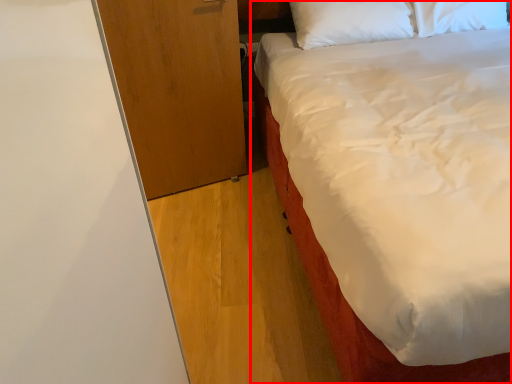
Question: From the image's perspective, what is the correct spatial relationship of bed (annotated by the red box) in relation to dresser?

Choices:
 (A) above
 (B) below

Answer: (A)